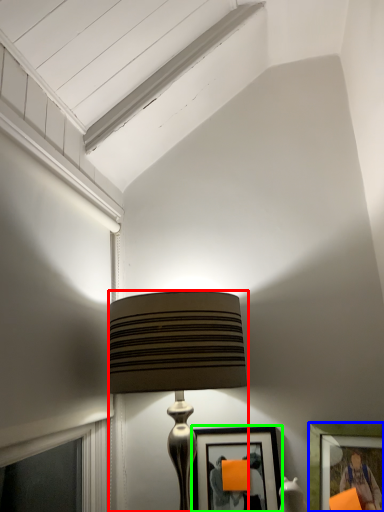
Question: Estimate the real-world distances between objects in this image. Which object is closer to lamp (highlighted by a red box), picture frame (highlighted by a blue box) or picture frame (highlighted by a green box)?

Choices:
 (A) picture frame
 (B) picture frame

Answer: (B)